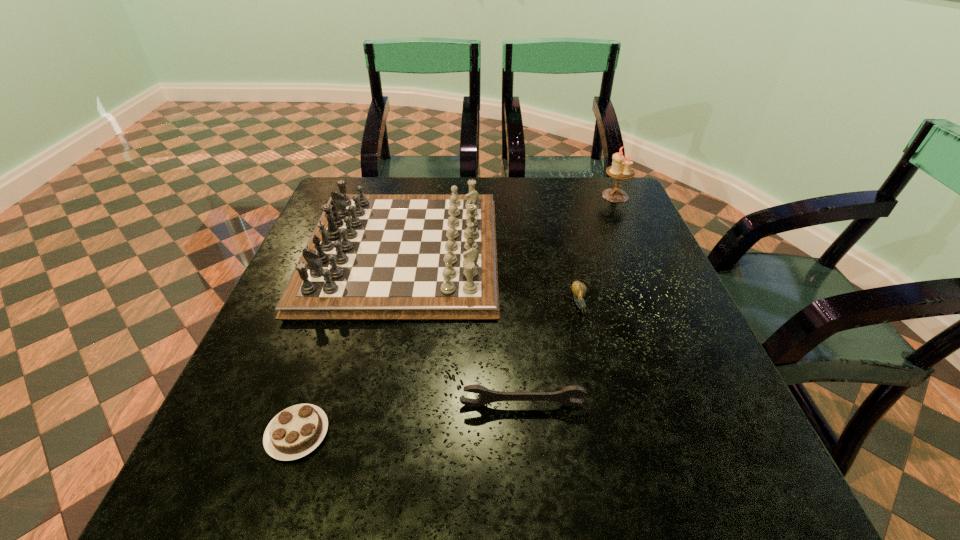
The height and width of the screenshot is (540, 960). In order to click on vacant space situated on the front-facing side of the second object from right to left in this screenshot , I will do `click(627, 498)`.

Locate an element on the screen. vacant space located 0.350m on the right of the chocolate cake is located at coordinates point(539,434).

Where is `candle holder positioned at the far edge`? candle holder positioned at the far edge is located at coordinates (621, 169).

The height and width of the screenshot is (540, 960). What are the coordinates of `chessboard present at the far edge` in the screenshot? It's located at (371, 256).

Locate an element on the screen. The image size is (960, 540). object that is at the near edge is located at coordinates (296, 431).

This screenshot has height=540, width=960. Identify the location of chessboard present at the left edge. (371, 256).

At what (x,y) coordinates should I click in order to perform the action: click on chocolate cake present at the left edge. Please return your answer as a coordinate pair (x, y). This screenshot has height=540, width=960. Looking at the image, I should click on (296, 431).

At what (x,y) coordinates should I click in order to perform the action: click on object positioned at the right edge. Please return your answer as a coordinate pair (x, y). The width and height of the screenshot is (960, 540). Looking at the image, I should click on (621, 169).

I want to click on object situated at the far left corner, so click(x=371, y=256).

The image size is (960, 540). I want to click on object that is at the near left corner, so click(x=296, y=431).